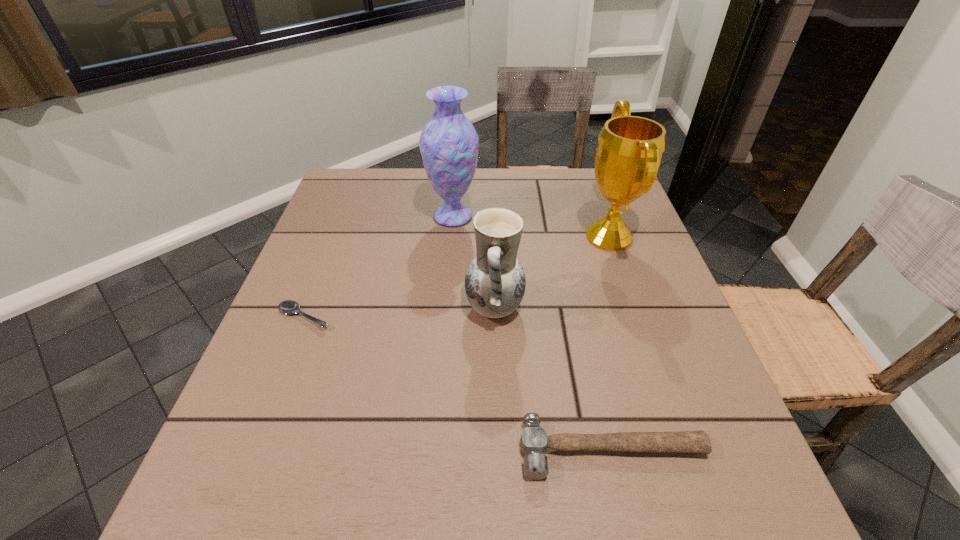
The image size is (960, 540). Find the location of `vacant space at the near right corner of the desktop`. vacant space at the near right corner of the desktop is located at coordinates pyautogui.click(x=656, y=510).

The width and height of the screenshot is (960, 540). In order to click on vacant point located between the award and the third shortest object in this screenshot , I will do `click(552, 272)`.

Where is `unoccupied position between the pottery and the nearest object`? The height and width of the screenshot is (540, 960). unoccupied position between the pottery and the nearest object is located at coordinates (553, 379).

Where is `free space that is in between the leftmost object and the award`? free space that is in between the leftmost object and the award is located at coordinates (457, 276).

Locate an element on the screen. The image size is (960, 540). vacant space in between the fourth tallest object and the leftmost object is located at coordinates (458, 383).

The height and width of the screenshot is (540, 960). In order to click on free spot between the third tallest object and the soupspoon in this screenshot , I will do `click(399, 312)`.

You are a GUI agent. You are given a task and a screenshot of the screen. Output one action in this format:
    pyautogui.click(x=<x>, y=<y>)
    Task: Click on the vacant area that lies between the award and the third tallest object
    The height and width of the screenshot is (540, 960).
    Given the screenshot: What is the action you would take?
    pyautogui.click(x=552, y=272)

Identify the location of vacant region between the award and the leftmost object. (457, 276).

Where is `free spot between the pottery and the soupspoon`? This screenshot has height=540, width=960. free spot between the pottery and the soupspoon is located at coordinates (399, 312).

Identify the location of free space between the pottery and the soupspoon. This screenshot has width=960, height=540. (399, 312).